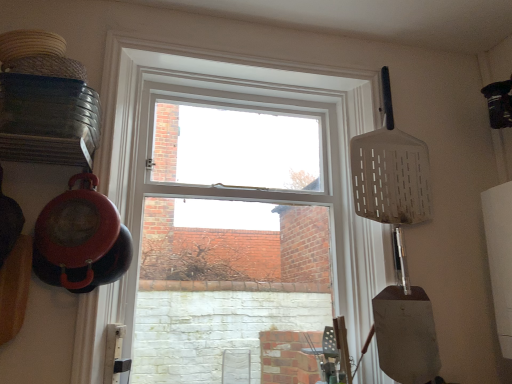
Question: In terms of size, does metallic silver shovel at right appear bigger or smaller than white plastic spatula at upper right?

Choices:
 (A) small
 (B) big

Answer: (A)

Question: From a real-world perspective, is metallic silver shovel at right physically located above or below white plastic spatula at upper right?

Choices:
 (A) above
 (B) below

Answer: (B)

Question: Which of these objects is positioned farthest from the metallic silver shovel at right?

Choices:
 (A) white plastic spatula at upper right
 (B) clear glass window at center

Answer: (B)

Question: Which object is the farthest from the white plastic spatula at upper right?

Choices:
 (A) clear glass window at center
 (B) metallic silver shovel at right

Answer: (B)